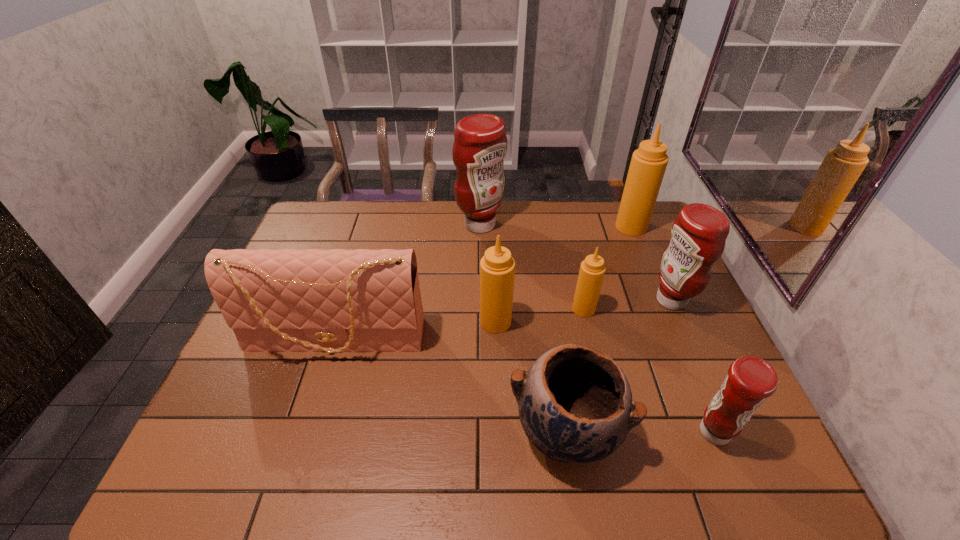
Locate an element on the screen. The image size is (960, 540). vacant space that satisfies the following two spatial constraints: 1. on the front side of the farthest red condiment; 2. on the left side of the smallest tan condiment is located at coordinates (480, 309).